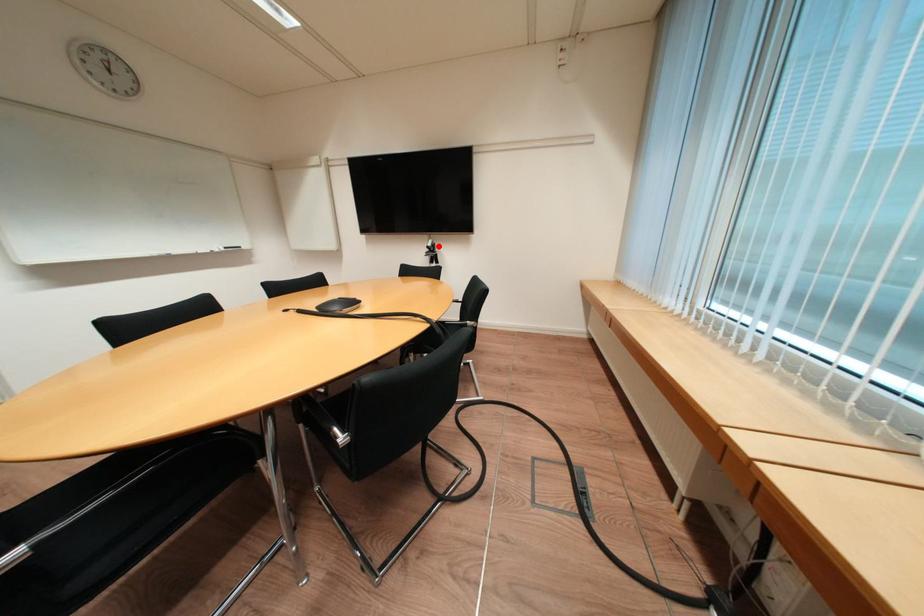
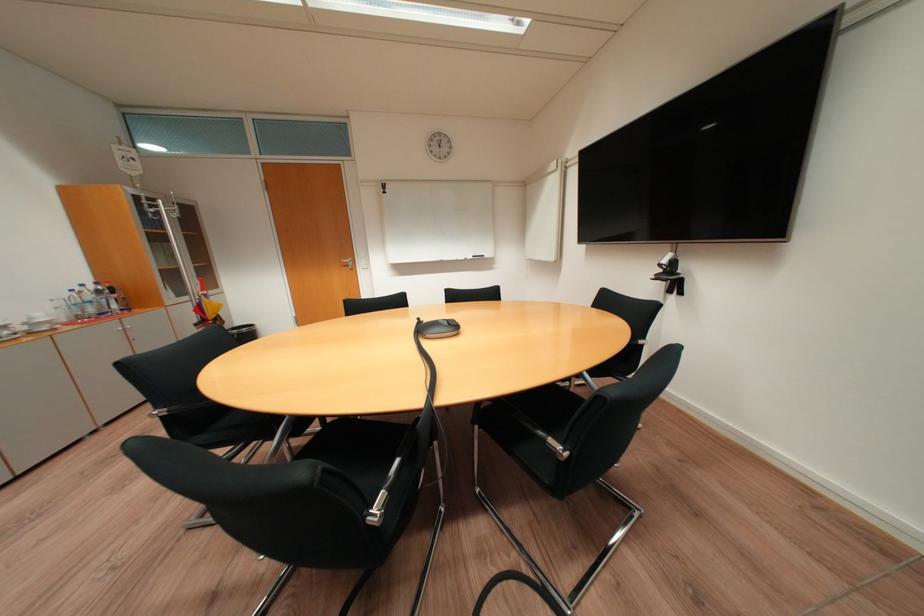
Locate, in the second image, the point that corresponds to the highlighted location in the first image.

(673, 262)